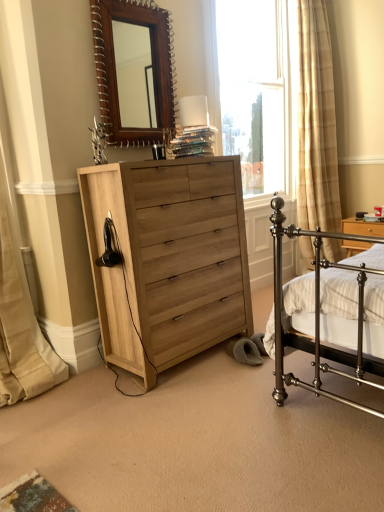
Question: Considering the relative sizes of beige fabric curtain at left and wooden nightstand at right in the image provided, is beige fabric curtain at left taller than wooden nightstand at right?

Choices:
 (A) yes
 (B) no

Answer: (A)

Question: From a real-world perspective, is beige fabric curtain at left positioned over wooden nightstand at right based on gravity?

Choices:
 (A) no
 (B) yes

Answer: (B)

Question: Is beige fabric curtain at left bigger than wooden nightstand at right?

Choices:
 (A) no
 (B) yes

Answer: (B)

Question: Considering the relative sizes of beige fabric curtain at left and wooden nightstand at right in the image provided, is beige fabric curtain at left thinner than wooden nightstand at right?

Choices:
 (A) yes
 (B) no

Answer: (B)

Question: Is beige fabric curtain at left in contact with wooden nightstand at right?

Choices:
 (A) yes
 (B) no

Answer: (B)

Question: Is beige fabric curtain at left at the left side of wooden nightstand at right?

Choices:
 (A) yes
 (B) no

Answer: (A)

Question: Is clear glass window at upper center bigger than wooden nightstand at right?

Choices:
 (A) no
 (B) yes

Answer: (B)

Question: Considering the relative sizes of clear glass window at upper center and wooden nightstand at right in the image provided, is clear glass window at upper center wider than wooden nightstand at right?

Choices:
 (A) no
 (B) yes

Answer: (A)

Question: Is clear glass window at upper center positioned before wooden nightstand at right?

Choices:
 (A) no
 (B) yes

Answer: (B)

Question: Is clear glass window at upper center at the right side of wooden nightstand at right?

Choices:
 (A) yes
 (B) no

Answer: (B)

Question: Is clear glass window at upper center far from wooden nightstand at right?

Choices:
 (A) no
 (B) yes

Answer: (B)

Question: Does clear glass window at upper center have a lesser width compared to wooden nightstand at right?

Choices:
 (A) no
 (B) yes

Answer: (B)

Question: Considering the relative sizes of wooden mirror at upper center and beige fabric curtain at left in the image provided, is wooden mirror at upper center shorter than beige fabric curtain at left?

Choices:
 (A) no
 (B) yes

Answer: (B)